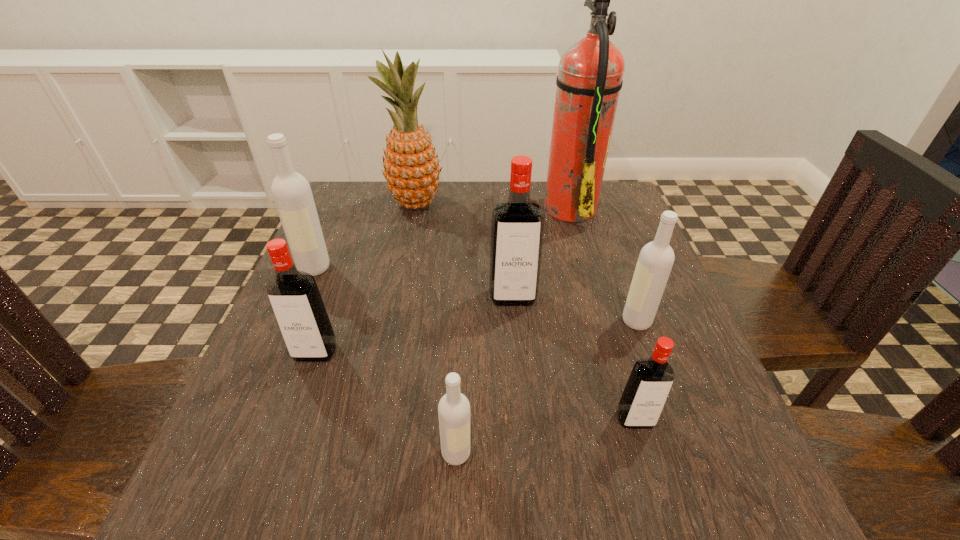
This screenshot has height=540, width=960. Identify the location of the tallest object. (589, 80).

In order to click on the seventh shortest object in this screenshot , I will do coord(411,167).

The height and width of the screenshot is (540, 960). Find the location of `the third object from left to right`. the third object from left to right is located at coordinates (411, 167).

Locate an element on the screen. The image size is (960, 540). the farthest white vodka is located at coordinates (291, 191).

The width and height of the screenshot is (960, 540). I want to click on the leftmost white vodka, so click(291, 191).

This screenshot has width=960, height=540. Find the location of `the fourth farthest object`. the fourth farthest object is located at coordinates (517, 223).

Where is `the fifth object from left to right`? The width and height of the screenshot is (960, 540). the fifth object from left to right is located at coordinates (517, 223).

What are the coordinates of `the second farthest white vodka` in the screenshot? It's located at (656, 258).

You are a GUI agent. You are given a task and a screenshot of the screen. Output one action in this format:
    pyautogui.click(x=<x>, y=<y>)
    Task: Click on the second biggest white vodka
    This screenshot has height=540, width=960.
    Given the screenshot: What is the action you would take?
    pyautogui.click(x=656, y=258)

Where is `the fourth farthest vodka`? The image size is (960, 540). the fourth farthest vodka is located at coordinates (294, 296).